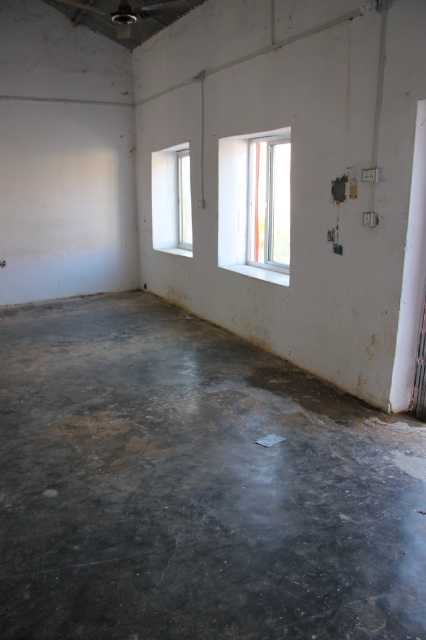
Between gray concrete floor at center and white glass window at upper left, which one is positioned higher?

white glass window at upper left

Does point (108, 305) come behind point (184, 180)?

No, (108, 305) is in front of (184, 180).

Find the location of a particular element. The image size is (426, 640). gray concrete floor at center is located at coordinates (195, 486).

Is white plastic window at center shorter than white glass window at upper left?

In fact, white plastic window at center may be taller than white glass window at upper left.

Measure the distance from white plastic window at center to white glass window at upper left.

white plastic window at center and white glass window at upper left are 1.99 meters apart.

Is point (253, 241) closer to camera compared to point (161, 234)?

That is True.

Image resolution: width=426 pixels, height=640 pixels. I want to click on white plastic window at center, so click(x=253, y=204).

Looking at this image, who is taller, gray concrete floor at center or white plastic window at center?

white plastic window at center

Who is positioned more to the left, gray concrete floor at center or white plastic window at center?

From the viewer's perspective, gray concrete floor at center appears more on the left side.

Who is more forward, (267, 572) or (270, 232)?

Positioned in front is point (267, 572).

Locate an element on the screen. This screenshot has height=640, width=426. gray concrete floor at center is located at coordinates (195, 486).